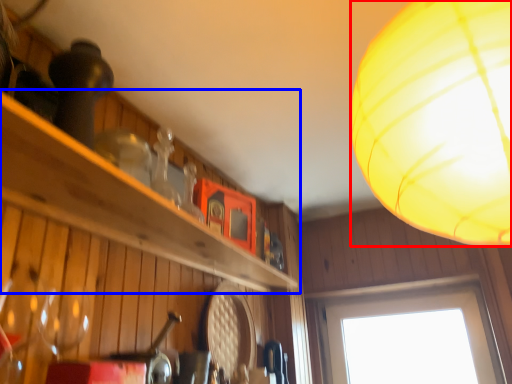
Question: Which point is further to the camera, lamp (highlighted by a red box) or shelf (highlighted by a blue box)?

Choices:
 (A) lamp
 (B) shelf

Answer: (B)